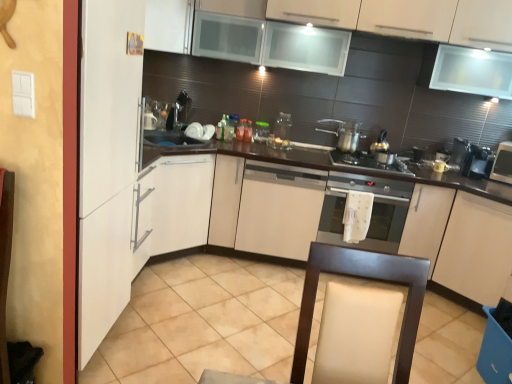
Question: Is white matte cabinet at upper left, which is the first cabinetry in top-to-bottom order, in front of or behind metallic silver coffee machine at right, placed as the 2th coffee machine when sorted from right to left, in the image?

Choices:
 (A) front
 (B) behind

Answer: (A)

Question: Choose the correct answer: Is white matte cabinet at upper left, the fourth cabinetry from the bottom, inside metallic silver coffee machine at right, which is the first coffee machine in left-to-right order, or outside it?

Choices:
 (A) outside
 (B) inside

Answer: (A)

Question: Which object is positioned closest to the metallic silver coffee machine at right, placed as the 2th coffee machine when sorted from right to left?

Choices:
 (A) metallic silver toaster at right, the first appliance viewed from the right
 (B) clear plastic container at center, the third appliance viewed from the right
 (C) metallic silver gas stove at center
 (D) black plastic coffee machine at right, the 1th coffee machine positioned from the right
 (E) metallic silver pot at center right

Answer: (D)

Question: Considering the real-world distances, which object is farthest from the dark wood countertop at center?

Choices:
 (A) white matte cabinet at upper left, which is the first cabinetry in top-to-bottom order
 (B) metallic silver gas stove at center
 (C) black plastic coffee machine at right, the 1th coffee machine positioned from the right
 (D) satin silver oven at center
 (E) metallic silver coffee machine at right, placed as the 2th coffee machine when sorted from right to left

Answer: (A)